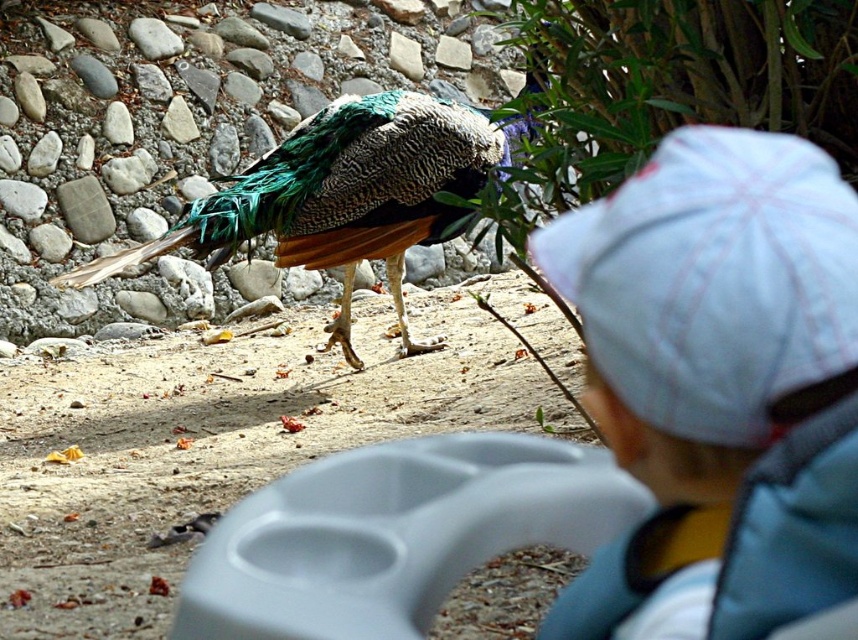
Question: Observing the image, what is the correct spatial positioning of white cotton hat at upper right in reference to shiny green peacock at center?

Choices:
 (A) below
 (B) above

Answer: (A)

Question: Which of the following is the farthest from the observer?

Choices:
 (A) (832, 381)
 (B) (500, 140)

Answer: (B)

Question: Can you confirm if white cotton hat at upper right is bigger than shiny green peacock at center?

Choices:
 (A) yes
 (B) no

Answer: (B)

Question: Among these points, which one is farthest from the camera?

Choices:
 (A) (186, 230)
 (B) (814, 566)

Answer: (A)

Question: Can you confirm if white cotton hat at upper right is smaller than shiny green peacock at center?

Choices:
 (A) yes
 (B) no

Answer: (A)

Question: Which of the following is the farthest from the observer?

Choices:
 (A) (113, 259)
 (B) (593, 620)

Answer: (A)